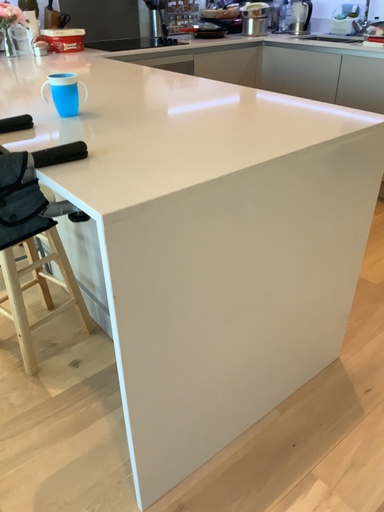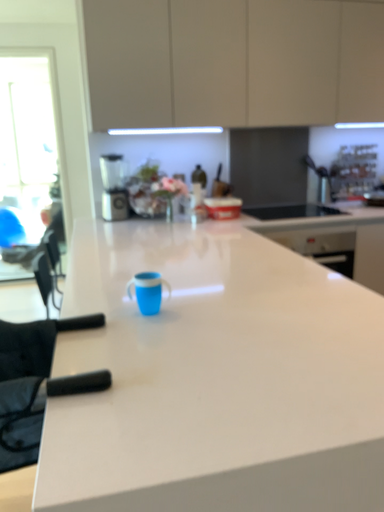
Question: Which way did the camera rotate in the video?

Choices:
 (A) rotated downward
 (B) rotated upward

Answer: (B)